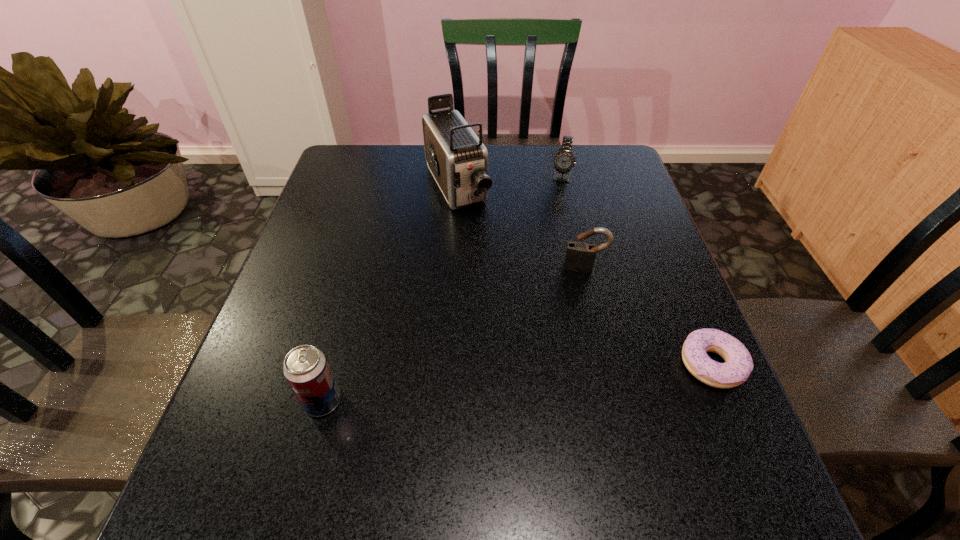
Image resolution: width=960 pixels, height=540 pixels. Identify the location of object that is at the near edge. (306, 369).

This screenshot has width=960, height=540. Identify the location of object that is positioned at the left edge. (306, 369).

Where is `doughnut that is at the right edge`? The image size is (960, 540). doughnut that is at the right edge is located at coordinates (738, 365).

Identify the location of padlock that is at the right edge. Image resolution: width=960 pixels, height=540 pixels. (580, 256).

What are the coordinates of `object located in the near left corner section of the desktop` in the screenshot? It's located at (306, 369).

Identify the location of vacant space at the far edge of the desktop. This screenshot has width=960, height=540. (533, 174).

Where is `free region at the near edge`? The image size is (960, 540). free region at the near edge is located at coordinates (433, 423).

Identify the location of vacant space at the left edge. The height and width of the screenshot is (540, 960). coord(346,304).

Locate an element on the screen. The height and width of the screenshot is (540, 960). vacant area at the right edge is located at coordinates (624, 260).

Image resolution: width=960 pixels, height=540 pixels. Identify the location of blank space at the near left corner of the desktop. (280, 443).